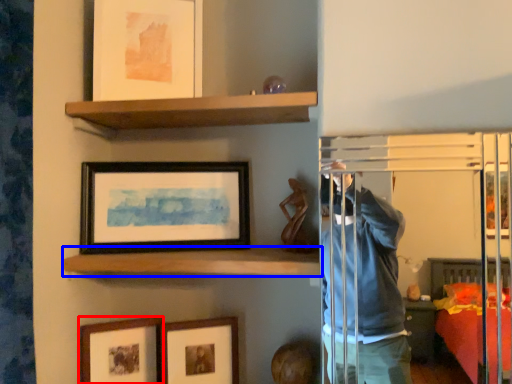
Question: Among these objects, which one is nearest to the camera, picture frame (highlighted by a red box) or shelf (highlighted by a blue box)?

Choices:
 (A) picture frame
 (B) shelf

Answer: (B)